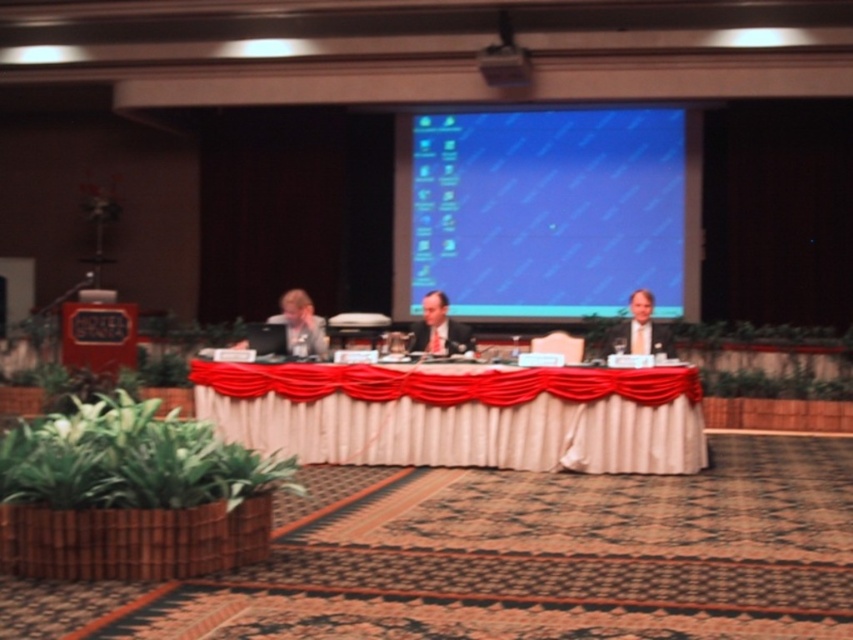
Question: Does smooth gray suit at center have a larger size compared to light brown hair at center?

Choices:
 (A) yes
 (B) no

Answer: (A)

Question: Does white satin table at center appear over smooth gray suit at center?

Choices:
 (A) no
 (B) yes

Answer: (A)

Question: Which is farther from the white satin table at center?

Choices:
 (A) matte gray suit at left
 (B) light brown hair at center

Answer: (A)

Question: Can you confirm if smooth gray suit at center is wider than matte gray suit at left?

Choices:
 (A) no
 (B) yes

Answer: (B)

Question: Which of the following is the closest to the observer?

Choices:
 (A) (286, 292)
 (B) (634, 337)

Answer: (B)

Question: Which object appears farthest from the camera in this image?

Choices:
 (A) light brown hair at center
 (B) white satin table at center
 (C) blue glossy projection screen at upper center

Answer: (C)